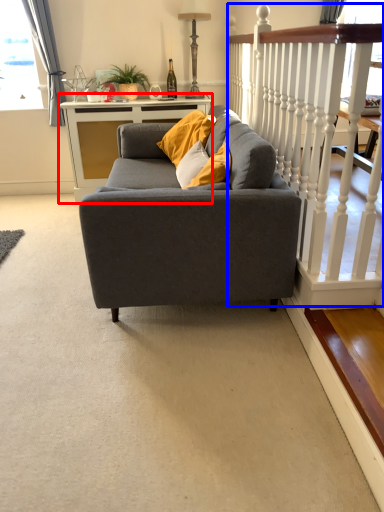
Question: Which of the following is the closest to the observer, table (highlighted by a red box) or rail (highlighted by a blue box)?

Choices:
 (A) table
 (B) rail

Answer: (B)